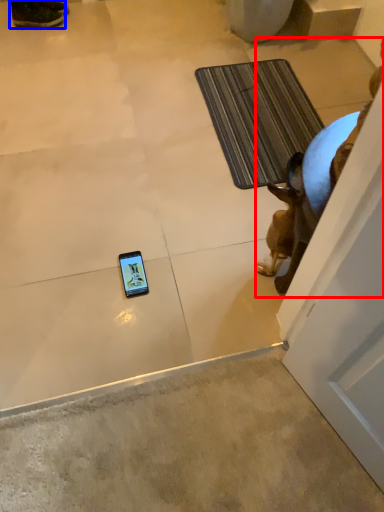
Question: Among these objects, which one is nearest to the camera, animal (highlighted by a red box) or footwear (highlighted by a blue box)?

Choices:
 (A) animal
 (B) footwear

Answer: (A)